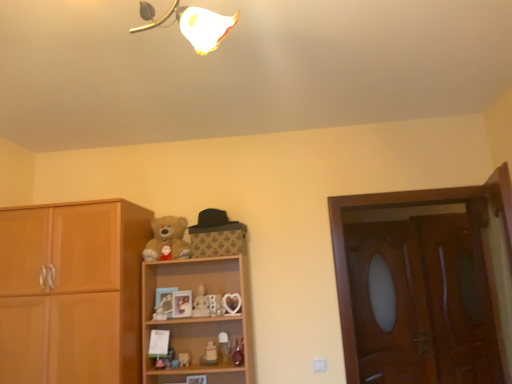
Question: Choose the correct answer: Is white glossy figurine at center, arranged as the fourth toy when viewed from the left, inside wooden door at right or outside it?

Choices:
 (A) inside
 (B) outside

Answer: (B)

Question: In the image, is white glossy figurine at center, arranged as the fourth toy when viewed from the left, on the left side or the right side of wooden door at right?

Choices:
 (A) right
 (B) left

Answer: (B)

Question: Based on their relative distances, which object is farther from the brown wooden screen door at right, the 1th screen door positioned from the right?

Choices:
 (A) bleached cotton teddy bear at center
 (B) wooden screen door at right, the 1th screen door positioned from the left
 (C) matte plastic toy at center, which appears as the 1th toy when viewed from the right
 (D) matte plastic cat at center, marked as the 4th toy in a right-to-left arrangement
 (E) wooden shelf at center

Answer: (D)

Question: Estimate the real-world distances between objects in this image. Which object is closer to the matte plastic cat at center, marked as the 4th toy in a right-to-left arrangement?

Choices:
 (A) white porcelain figurine at center, the third toy positioned from the right
 (B) white glossy figurine at center, arranged as the fourth toy when viewed from the left
 (C) matte plastic teddy bear at center, marked as the first toy in a left-to-right arrangement
 (D) wooden shelf at center
 (E) wooden screen door at right, marked as the 2th screen door in a right-to-left arrangement

Answer: (B)